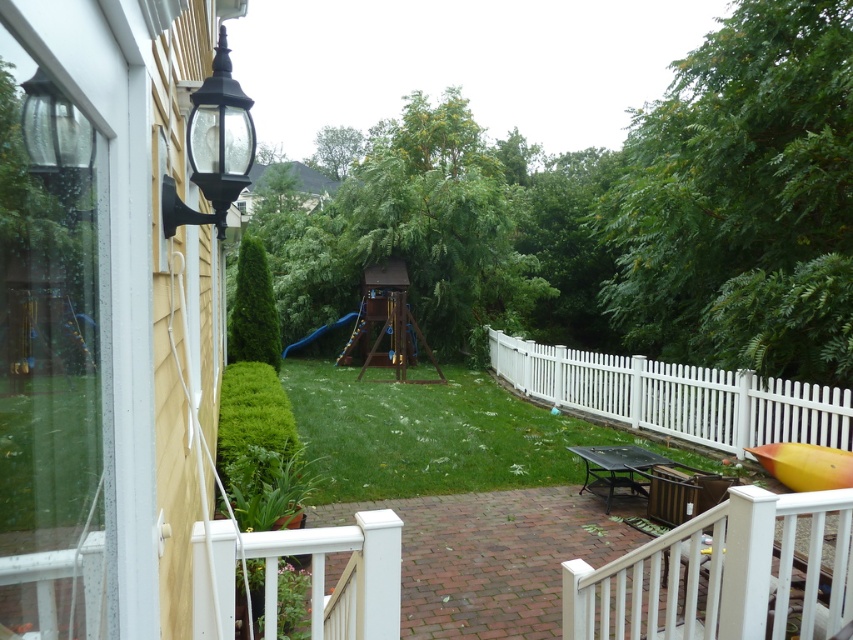
Question: Can you confirm if white painted wood porch at lower center is smaller than white picket fence at lower right?

Choices:
 (A) no
 (B) yes

Answer: (A)

Question: Does green grass at center appear on the left side of black glass lamp at upper left?

Choices:
 (A) no
 (B) yes

Answer: (A)

Question: Which point is farther from the camera taking this photo?

Choices:
 (A) (639, 577)
 (B) (225, 189)
 (C) (546, 426)

Answer: (C)

Question: Considering the real-world distances, which object is closest to the white painted wood porch at lower center?

Choices:
 (A) green grass at center
 (B) blue rubber slide at center
 (C) white picket fence at lower right

Answer: (C)

Question: Estimate the real-world distances between objects in this image. Which object is closer to the green grass at center?

Choices:
 (A) white picket fence at lower right
 (B) white painted wood porch at lower center
 (C) black glass lamp at upper left

Answer: (A)

Question: Can you confirm if white painted wood porch at lower center is positioned below black glass lamp at upper left?

Choices:
 (A) no
 (B) yes

Answer: (B)